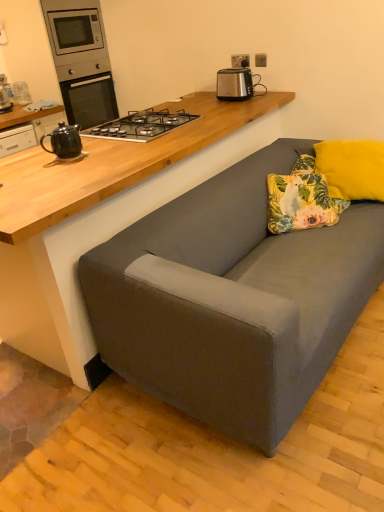
Question: Considering the relative sizes of black metal/glass gas stove at upper center and satin silver toaster at upper center in the image provided, is black metal/glass gas stove at upper center shorter than satin silver toaster at upper center?

Choices:
 (A) yes
 (B) no

Answer: (A)

Question: Is satin silver toaster at upper center inside black metal/glass gas stove at upper center?

Choices:
 (A) no
 (B) yes

Answer: (A)

Question: Is the position of black metal/glass gas stove at upper center more distant than that of satin silver toaster at upper center?

Choices:
 (A) yes
 (B) no

Answer: (B)

Question: Does black metal/glass gas stove at upper center come in front of satin silver toaster at upper center?

Choices:
 (A) no
 (B) yes

Answer: (B)

Question: Does black metal/glass gas stove at upper center have a greater height compared to satin silver toaster at upper center?

Choices:
 (A) no
 (B) yes

Answer: (A)

Question: Does black metal/glass gas stove at upper center have a lesser width compared to satin silver toaster at upper center?

Choices:
 (A) yes
 (B) no

Answer: (B)

Question: From a real-world perspective, is floral fabric pillow at center, which is the 1th pillow from left to right, beneath brushed metal microwave at upper left?

Choices:
 (A) yes
 (B) no

Answer: (A)

Question: From a real-world perspective, is floral fabric pillow at center, acting as the 2th pillow starting from the right, on top of brushed metal microwave at upper left?

Choices:
 (A) no
 (B) yes

Answer: (A)

Question: Is brushed metal microwave at upper left inside floral fabric pillow at center, which is the 1th pillow from left to right?

Choices:
 (A) no
 (B) yes

Answer: (A)

Question: Does floral fabric pillow at center, which is the 1th pillow from left to right, have a larger size compared to brushed metal microwave at upper left?

Choices:
 (A) yes
 (B) no

Answer: (B)

Question: Is floral fabric pillow at center, which is the 1th pillow from left to right, aimed at brushed metal microwave at upper left?

Choices:
 (A) no
 (B) yes

Answer: (A)

Question: Is floral fabric pillow at center, which is the 1th pillow from left to right, smaller than brushed metal microwave at upper left?

Choices:
 (A) yes
 (B) no

Answer: (A)

Question: Is brushed metal microwave at upper left next to black ceramic teapot at left and touching it?

Choices:
 (A) yes
 (B) no

Answer: (B)